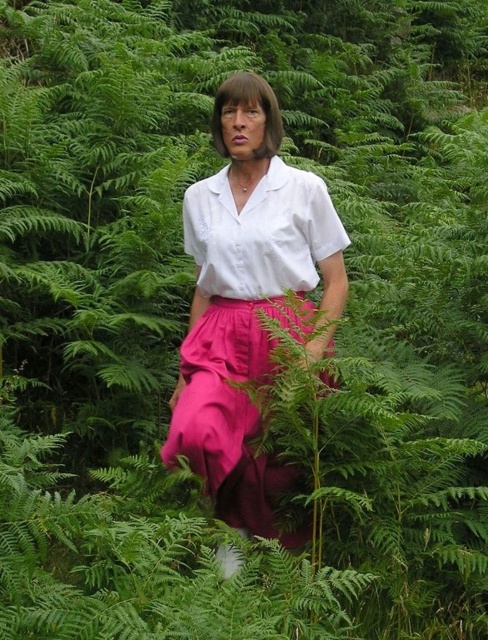
Question: Is matte pink skirt at center thinner than white cotton shirt at center?

Choices:
 (A) yes
 (B) no

Answer: (B)

Question: Does matte pink fabric skirt at center have a larger size compared to white cotton shirt at center?

Choices:
 (A) yes
 (B) no

Answer: (A)

Question: Which object is the farthest from the matte pink fabric skirt at center?

Choices:
 (A) matte pink skirt at center
 (B) white cotton shirt at center

Answer: (B)

Question: Which of these objects is positioned closest to the matte pink skirt at center?

Choices:
 (A) matte pink fabric skirt at center
 (B) white cotton shirt at center

Answer: (A)

Question: Which point is closer to the camera?

Choices:
 (A) white cotton shirt at center
 (B) matte pink skirt at center
 (C) matte pink fabric skirt at center

Answer: (B)

Question: Is matte pink fabric skirt at center smaller than white cotton shirt at center?

Choices:
 (A) yes
 (B) no

Answer: (B)